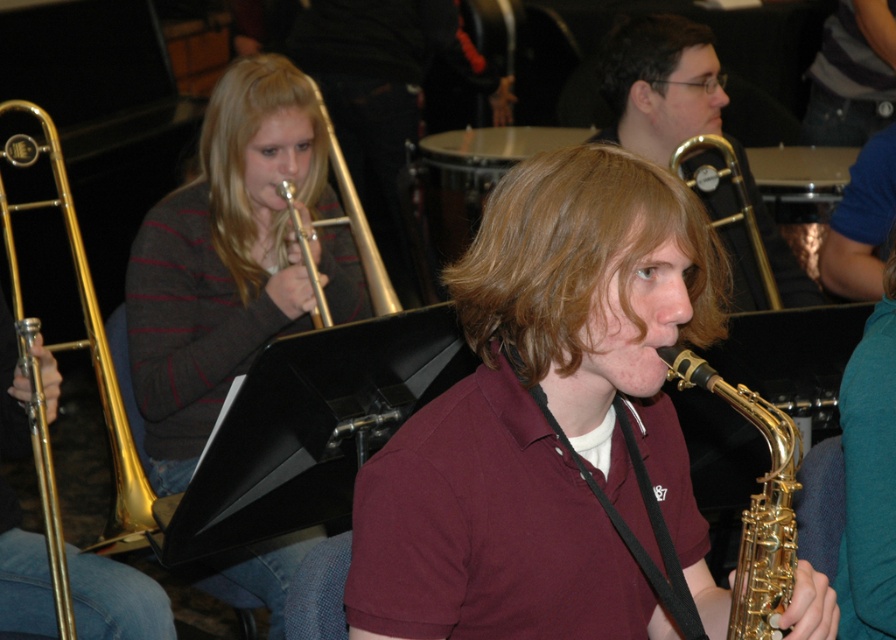
Is point (629, 250) positioned before point (45, 120)?

Yes, it is in front of point (45, 120).

Who is taller, blonde wavy hair at center or gold brass trombone at left?

gold brass trombone at left is taller.

Is point (488, 317) positioned behind point (79, 250)?

That is False.

Locate an element on the screen. The image size is (896, 640). blonde wavy hair at center is located at coordinates (576, 257).

Looking at this image, does dark brown hair at upper center appear over matte gold trumpet at upper left?

Correct, dark brown hair at upper center is located above matte gold trumpet at upper left.

Which of these two, dark brown hair at upper center or matte gold trumpet at upper left, stands shorter?

dark brown hair at upper center is shorter.

What do you see at coordinates (645, 52) in the screenshot? I see `dark brown hair at upper center` at bounding box center [645, 52].

Locate an element on the screen. The height and width of the screenshot is (640, 896). dark brown hair at upper center is located at coordinates tap(645, 52).

Can you confirm if matte gold trombone at upper center is positioned to the right of blondehair at upper left?

Indeed, matte gold trombone at upper center is positioned on the right side of blondehair at upper left.

The image size is (896, 640). Identify the location of matte gold trombone at upper center. pyautogui.click(x=660, y=84).

Locate an element on the screen. matte gold trombone at upper center is located at coordinates (660, 84).